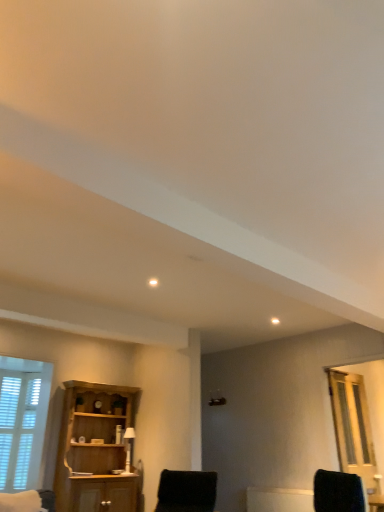
Question: Does black fuzzy chair at lower center touch clear glass door at right?

Choices:
 (A) no
 (B) yes

Answer: (A)

Question: Is black fuzzy chair at lower center turned away from clear glass door at right?

Choices:
 (A) no
 (B) yes

Answer: (A)

Question: Can you confirm if black fuzzy chair at lower center is bigger than clear glass door at right?

Choices:
 (A) no
 (B) yes

Answer: (B)

Question: Can you confirm if black fuzzy chair at lower center is positioned to the right of clear glass door at right?

Choices:
 (A) no
 (B) yes

Answer: (A)

Question: Does black fuzzy chair at lower center have a lesser width compared to clear glass door at right?

Choices:
 (A) no
 (B) yes

Answer: (A)

Question: Visually, is wooden cabinet at left positioned to the left or to the right of white wooden window at lower left?

Choices:
 (A) right
 (B) left

Answer: (A)

Question: Considering their positions, is wooden cabinet at left located in front of or behind white wooden window at lower left?

Choices:
 (A) behind
 (B) front

Answer: (A)

Question: Does point (89, 423) appear closer or farther from the camera than point (43, 376)?

Choices:
 (A) farther
 (B) closer

Answer: (A)

Question: From the image's perspective, is wooden cabinet at left located above or below white wooden window at lower left?

Choices:
 (A) above
 (B) below

Answer: (B)

Question: Is clear glass door at right to the left or to the right of wooden cabinet at left in the image?

Choices:
 (A) left
 (B) right

Answer: (B)

Question: From their relative heights in the image, would you say clear glass door at right is taller or shorter than wooden cabinet at left?

Choices:
 (A) short
 (B) tall

Answer: (A)

Question: Is point (340, 406) closer or farther from the camera than point (69, 487)?

Choices:
 (A) closer
 (B) farther

Answer: (B)

Question: Based on their sizes in the image, would you say clear glass door at right is bigger or smaller than wooden cabinet at left?

Choices:
 (A) small
 (B) big

Answer: (A)

Question: Relative to wooden cabinet at left, is black fuzzy chair at lower center in front or behind?

Choices:
 (A) front
 (B) behind

Answer: (A)

Question: Looking at the image, does black fuzzy chair at lower center seem bigger or smaller compared to wooden cabinet at left?

Choices:
 (A) small
 (B) big

Answer: (A)